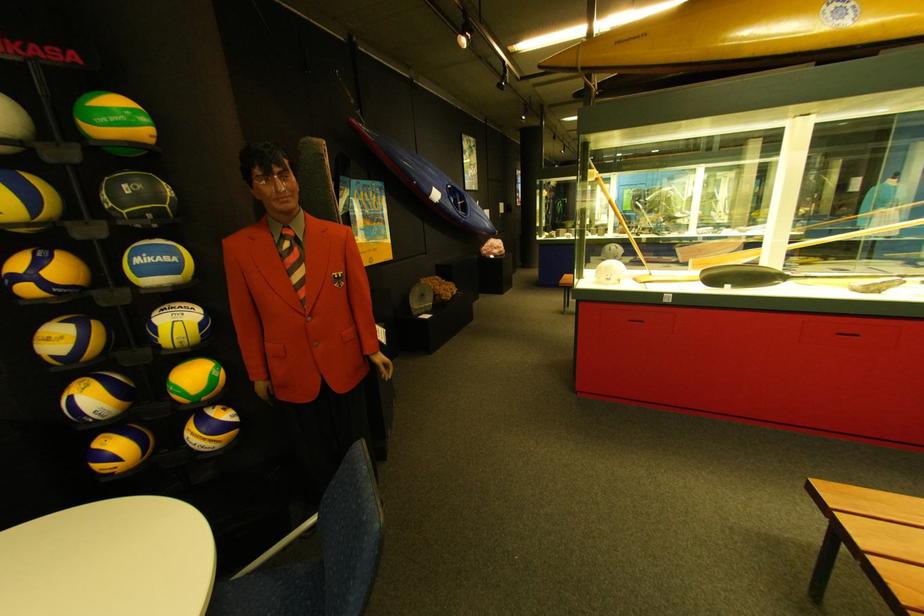
Image resolution: width=924 pixels, height=616 pixels. Describe the element at coordinates (273, 592) in the screenshot. I see `the blue chair sitting surface` at that location.